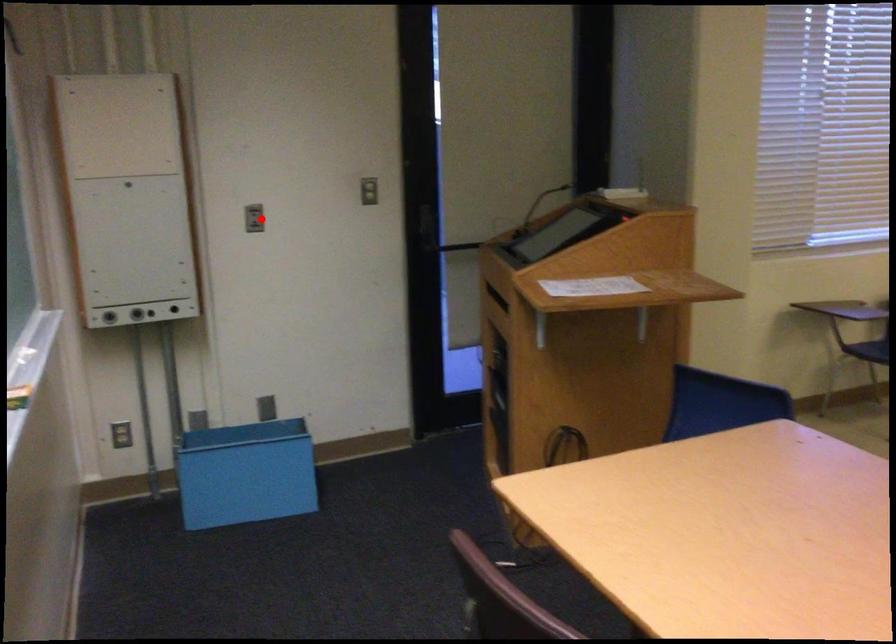
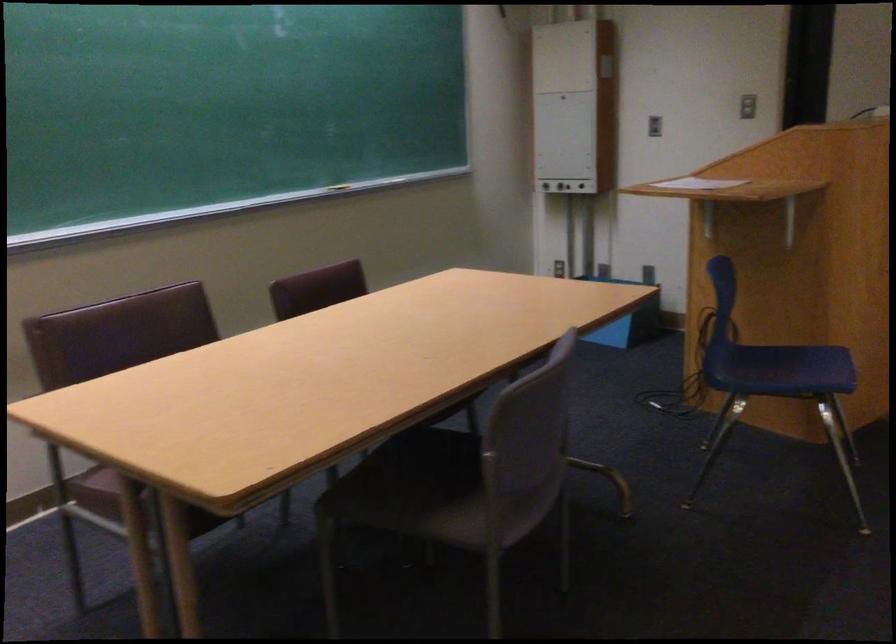
Locate, in the second image, the point that corresponds to the highlighted location in the first image.

(653, 126)